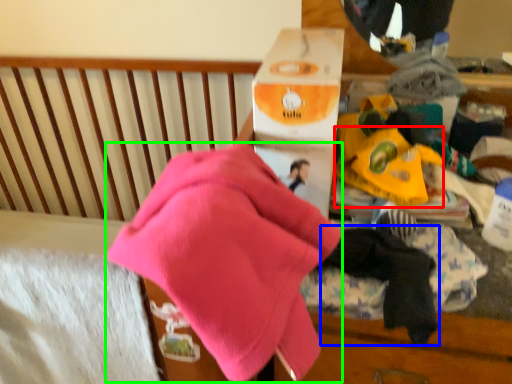
Question: Considering the real-world distances, which object is closest to toy (highlighted by a red box)? baby clothe (highlighted by a blue box) or underclothes (highlighted by a green box).

Choices:
 (A) baby clothe
 (B) underclothes

Answer: (A)